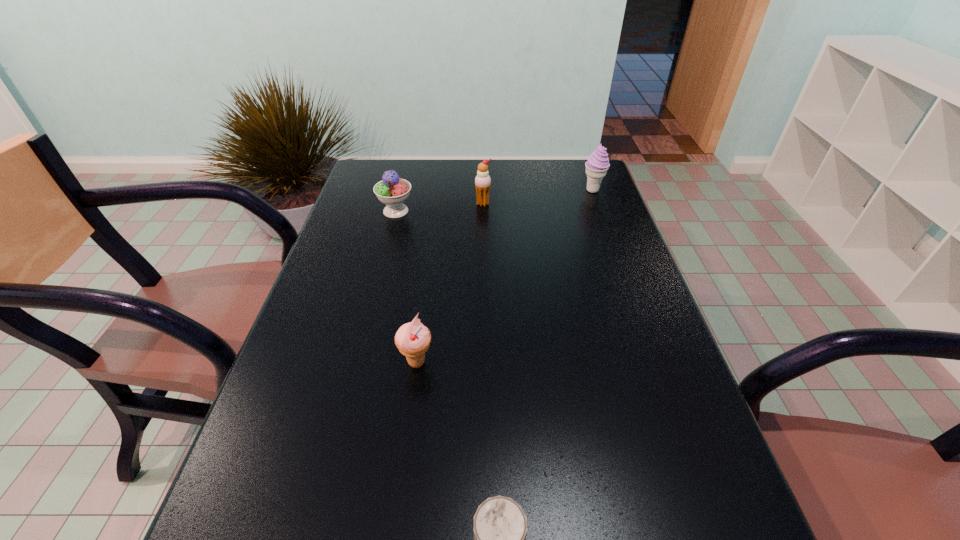
Locate an element on the screen. This screenshot has height=540, width=960. the farthest icecream is located at coordinates (597, 165).

The image size is (960, 540). I want to click on the rightmost object, so [x=597, y=165].

At what (x,y) coordinates should I click in order to perform the action: click on the third icecream from left to right. Please return your answer as a coordinate pair (x, y). Looking at the image, I should click on (482, 181).

Find the location of a particular element. Image resolution: width=960 pixels, height=540 pixels. the leftmost object is located at coordinates (392, 191).

The height and width of the screenshot is (540, 960). What are the coordinates of `the third icecream from right to left` in the screenshot? It's located at (412, 339).

This screenshot has width=960, height=540. What are the coordinates of `the fourth object from right to left` in the screenshot? It's located at (412, 339).

The image size is (960, 540). Find the location of `free space located 0.290m on the left of the farthest icecream`. free space located 0.290m on the left of the farthest icecream is located at coordinates (491, 191).

Find the location of a particular element. Image resolution: width=960 pixels, height=540 pixels. vacant space located at the front with a straw on the third icecream from left to right is located at coordinates (484, 279).

This screenshot has width=960, height=540. In order to click on vacant space situated on the front of the leftmost icecream in this screenshot , I will do `click(374, 296)`.

Find the location of a particular element. This screenshot has height=540, width=960. free space located 0.230m on the right of the second object from left to right is located at coordinates (545, 362).